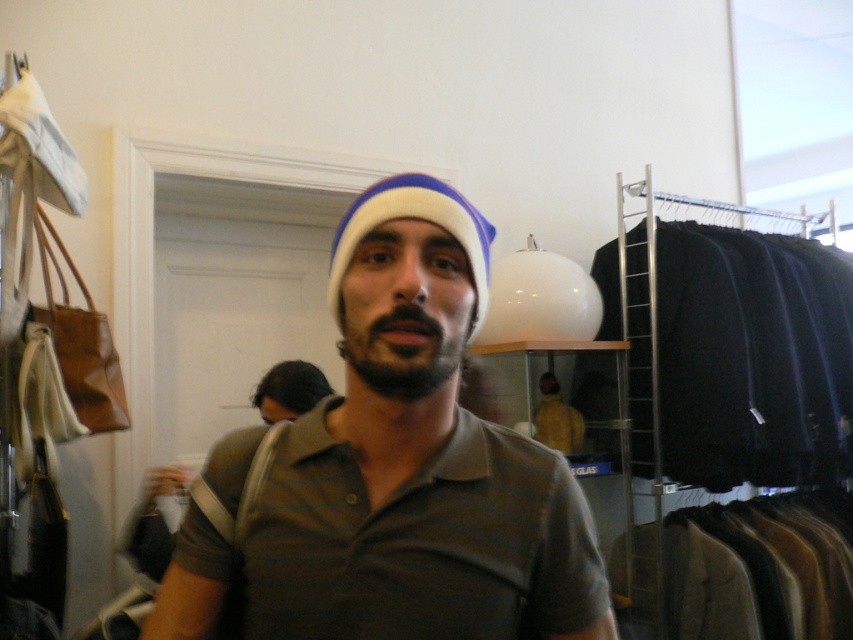
Does green striped polo shirt at center appear on the right side of white knit beanie at center?

In fact, green striped polo shirt at center is to the left of white knit beanie at center.

Describe the element at coordinates (421, 541) in the screenshot. I see `green striped polo shirt at center` at that location.

I want to click on green striped polo shirt at center, so click(x=421, y=541).

Which is below, brown striped polo shirt at center or black fabric at right?

Positioned lower is black fabric at right.

The width and height of the screenshot is (853, 640). Find the location of `brown striped polo shirt at center`. brown striped polo shirt at center is located at coordinates (416, 461).

Who is positioned more to the left, brown striped polo shirt at center or white knit beanie at center?

From the viewer's perspective, white knit beanie at center appears more on the left side.

Which is behind, point (380, 376) or point (469, 220)?

Positioned behind is point (469, 220).

The width and height of the screenshot is (853, 640). What do you see at coordinates (416, 461) in the screenshot?
I see `brown striped polo shirt at center` at bounding box center [416, 461].

You are a GUI agent. You are given a task and a screenshot of the screen. Output one action in this format:
    pyautogui.click(x=<x>, y=<y>)
    Task: Click on the brown striped polo shirt at center
    The width and height of the screenshot is (853, 640).
    Given the screenshot: What is the action you would take?
    pyautogui.click(x=416, y=461)